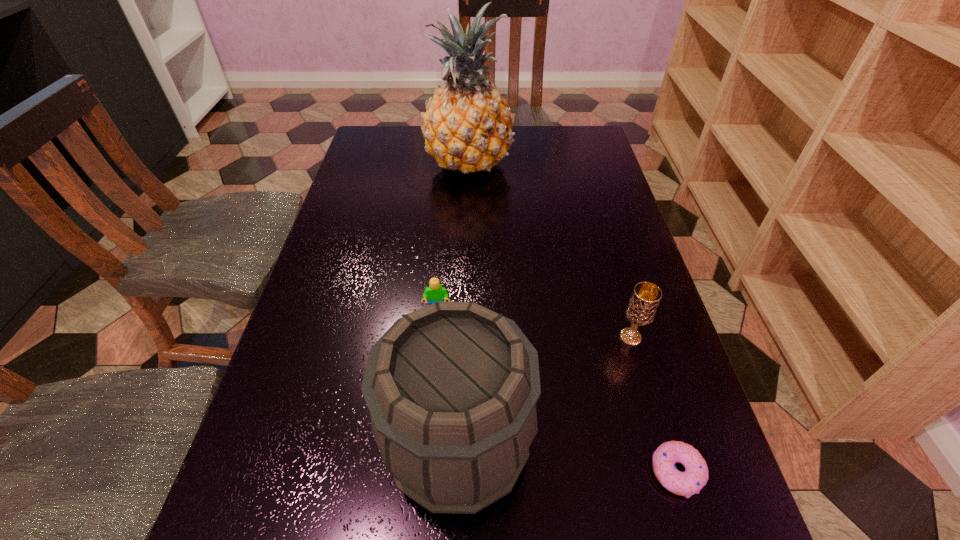
Locate an element on the screen. vacant space located 0.370m on the back of the third nearest object is located at coordinates (595, 215).

Where is `vacant space located 0.320m on the face of the Lego`? Image resolution: width=960 pixels, height=540 pixels. vacant space located 0.320m on the face of the Lego is located at coordinates (423, 469).

The height and width of the screenshot is (540, 960). What are the coordinates of `vacant space located 0.110m on the left of the shortest object` in the screenshot? It's located at (582, 472).

At what (x,y) coordinates should I click in order to perform the action: click on object that is at the far edge. Please return your answer as a coordinate pair (x, y). This screenshot has height=540, width=960. Looking at the image, I should click on (468, 126).

Where is `chalice that is at the right edge`? The width and height of the screenshot is (960, 540). chalice that is at the right edge is located at coordinates (641, 309).

Where is `doughnut at the right edge`? doughnut at the right edge is located at coordinates (690, 482).

Image resolution: width=960 pixels, height=540 pixels. I want to click on free point at the far edge, so click(x=523, y=160).

Image resolution: width=960 pixels, height=540 pixels. In order to click on free region at the left edge of the desktop in this screenshot , I will do `click(351, 177)`.

Where is `free spot at the right edge of the desktop`? free spot at the right edge of the desktop is located at coordinates (633, 485).

Identify the location of vacant space at the far left corner. (x=385, y=153).